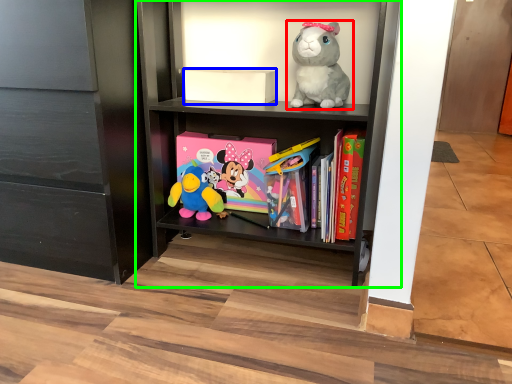
Question: Which object is positioned closest to toy (highlighted by a red box)? Select from box (highlighted by a blue box) and shelf (highlighted by a green box).

Choices:
 (A) box
 (B) shelf

Answer: (A)